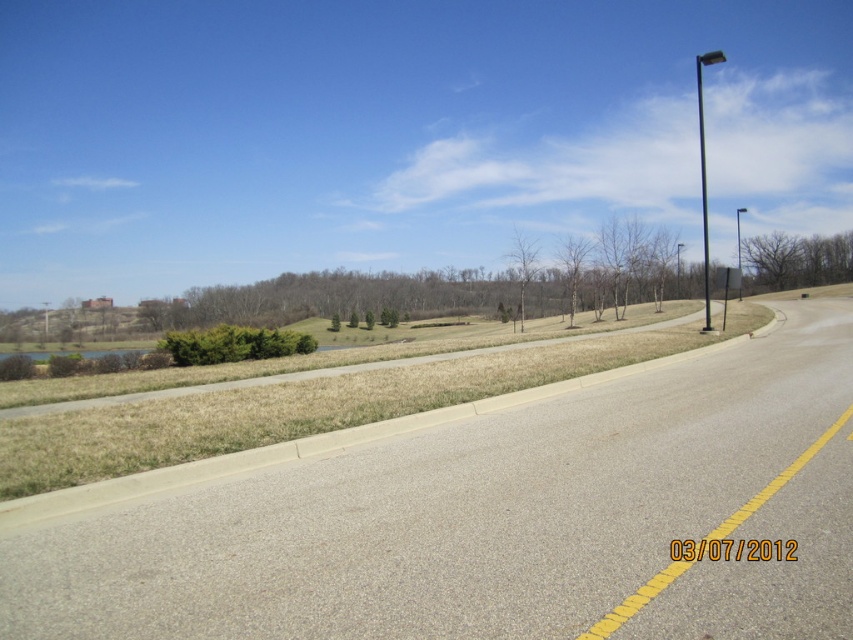
Question: Based on their relative distances, which object is nearer to the black metal pole at upper right?

Choices:
 (A) brown textured tree at upper right
 (B) black metal pole at right
 (C) bare branch at center
 (D) bare branches at center

Answer: (A)

Question: Is brown textured tree at upper right wider than bare branches at center?

Choices:
 (A) yes
 (B) no

Answer: (A)

Question: Estimate the real-world distances between objects in this image. Which object is farther from the gray asphalt highway at center?

Choices:
 (A) bare branch at center
 (B) black metal pole at upper right

Answer: (A)

Question: Among these objects, which one is farthest from the camera?

Choices:
 (A) bare branches at center
 (B) black metal pole at right

Answer: (A)

Question: Is gray asphalt highway at center closer to camera compared to black metal pole at upper right?

Choices:
 (A) no
 (B) yes

Answer: (B)

Question: Is gray asphalt highway at center in front of bare branches at center?

Choices:
 (A) no
 (B) yes

Answer: (B)